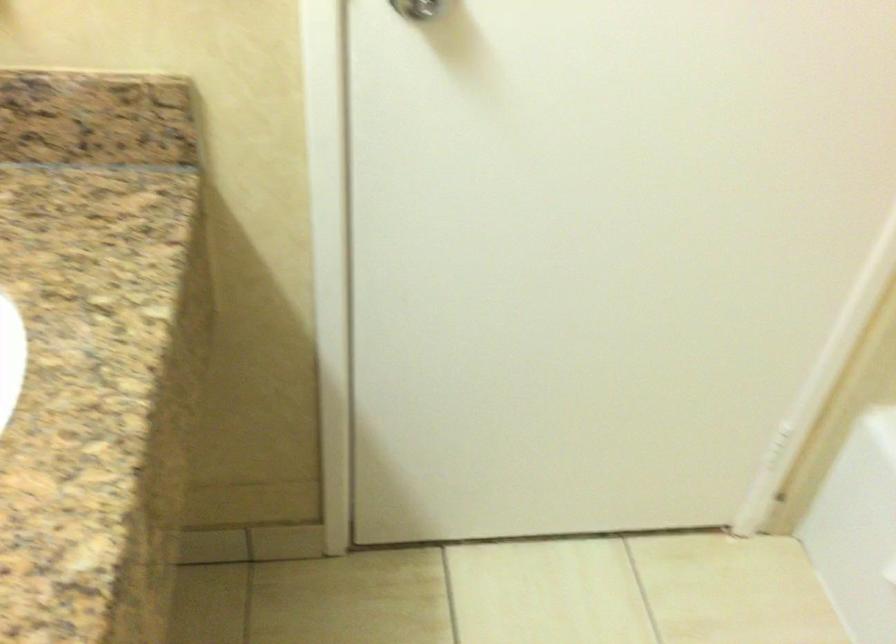
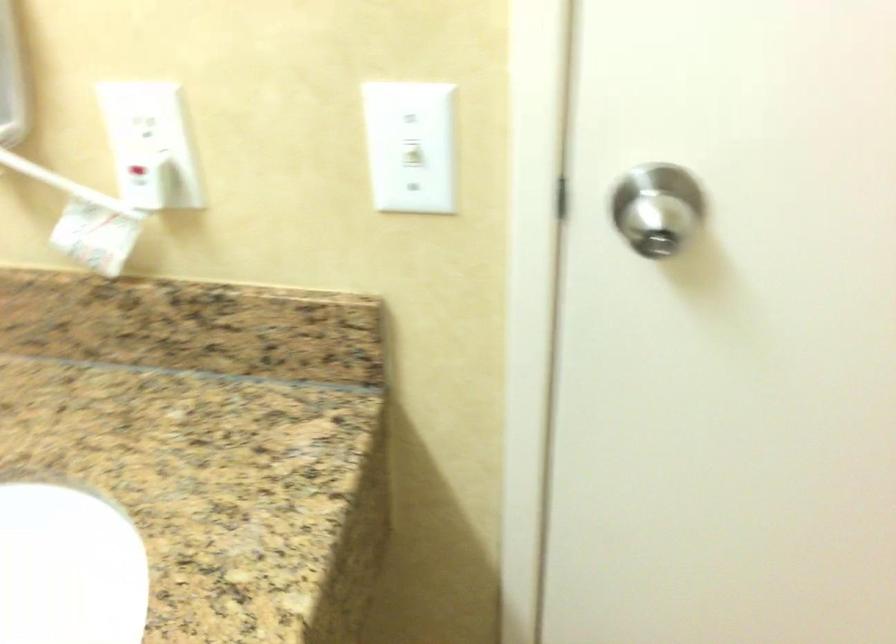
Question: The images are taken continuously from a first-person perspective. In which direction are you moving?

Choices:
 (A) Left
 (B) Right
 (C) Forward
 (D) Backward

Answer: (C)